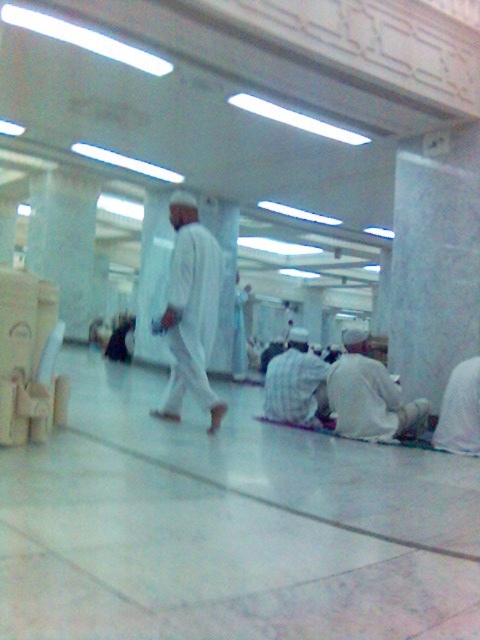
Consider the image. You are standing at the entrance of the mosque and see two points marked in the image. The first point is at coordinate point (x=360, y=358) and the second is at point (x=276, y=374). Which point is closer to you?

Point (x=360, y=358) is in front of point (x=276, y=374), so it is closer to you.

You are a photographer trying to capture a closeup of the white matte cloth at lower right without including the white matte clothing at center in the frame. Based on their sizes, which object should you focus on to ensure it fills the frame appropriately?

The white matte cloth at lower right is smaller than the white matte clothing at center. To capture a closeup of the white matte cloth at lower right without including the white matte clothing at center, you should focus on the smaller object since it requires getting closer or using a zoom lens to fill the frame appropriately.

You are a photographer trying to capture a clear image of both the white matte clothing at center and the white matte robe at lower right. Which object should you focus on first if you want to ensure both are in focus?

The white matte robe at lower right is smaller than the white matte clothing at center. To ensure both are in focus, you should focus on the white matte robe at lower right first, as it is closer to the camera. This way, the depth of field will extend to the larger object at the center.